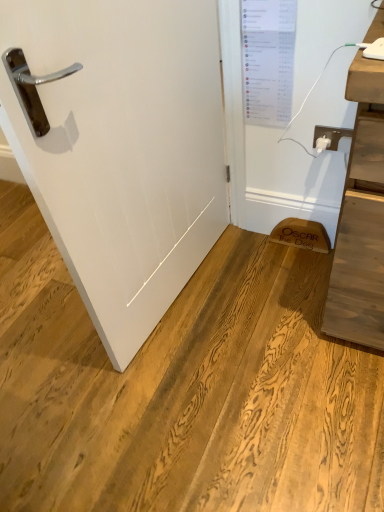
Question: Considering their positions, is white matte door at center located in front of or behind white plastic plug at upper right?

Choices:
 (A) behind
 (B) front

Answer: (B)

Question: Considering the positions of point (168, 217) and point (327, 132), is point (168, 217) closer or farther from the camera than point (327, 132)?

Choices:
 (A) closer
 (B) farther

Answer: (A)

Question: In terms of width, does white matte door at center look wider or thinner when compared to white plastic plug at upper right?

Choices:
 (A) wide
 (B) thin

Answer: (A)

Question: Would you say white plastic plug at upper right is inside or outside white matte door at center?

Choices:
 (A) outside
 (B) inside

Answer: (A)

Question: From the image's perspective, is white plastic plug at upper right above or below white matte door at center?

Choices:
 (A) below
 (B) above

Answer: (B)

Question: Does point (329, 147) appear closer or farther from the camera than point (147, 258)?

Choices:
 (A) farther
 (B) closer

Answer: (A)

Question: Based on their sizes in the image, would you say white plastic plug at upper right is bigger or smaller than white matte door at center?

Choices:
 (A) small
 (B) big

Answer: (A)